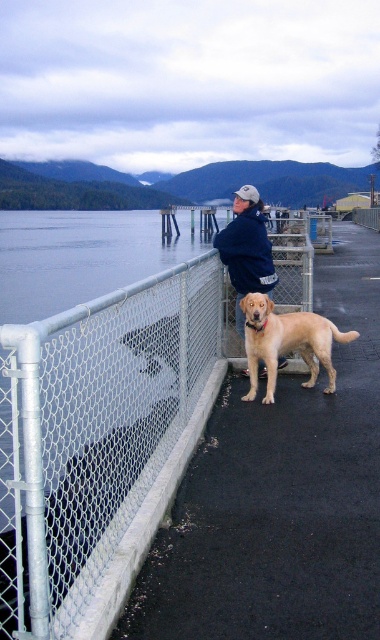
You are standing at the point with coordinates point (95,432) in the image. What object are you looking at?

The point (95,432) corresponds to the white chainlink fence at centerleft.